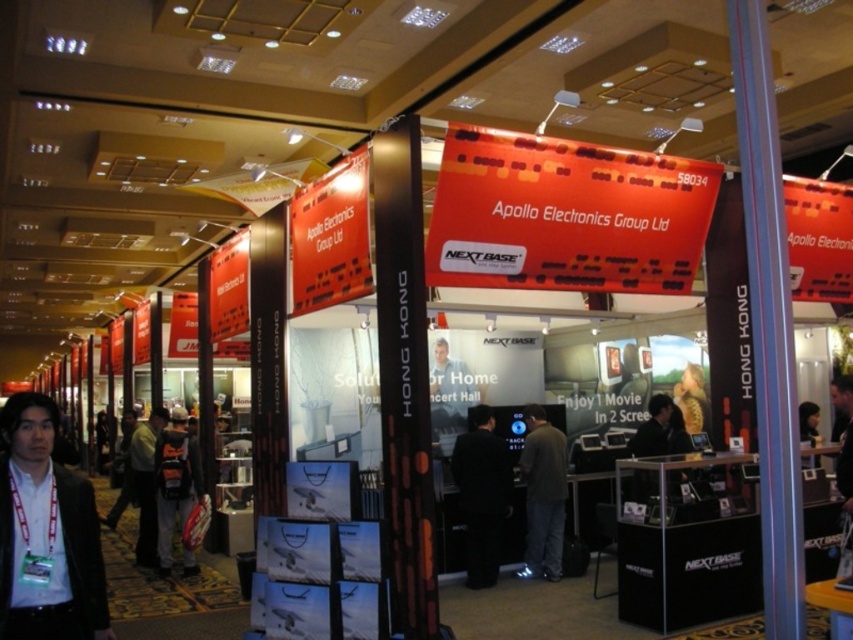
Question: Can you confirm if matte black suit at lower left is positioned below dark gray fabric jacket at center?

Choices:
 (A) yes
 (B) no

Answer: (B)

Question: Considering the real-world distances, which object is farthest from the dark gray suit at center?

Choices:
 (A) matte black suit at lower left
 (B) dark gray fabric jacket at center
 (C) orange fabric backpack at center

Answer: (A)

Question: Observing the image, what is the correct spatial positioning of orange fabric backpack at center in reference to dark gray suit at center?

Choices:
 (A) below
 (B) above

Answer: (B)

Question: Which point is farther to the camera?

Choices:
 (A) orange fabric backpack at center
 (B) matte black suit at lower left

Answer: (A)

Question: Is dark gray fabric jacket at center positioned in front of dark gray suit at center?

Choices:
 (A) no
 (B) yes

Answer: (B)

Question: Based on their relative distances, which object is farther from the dark gray fabric jacket at center?

Choices:
 (A) matte black suit at lower left
 (B) dark gray suit at center
 (C) black fabric jacket at center
 (D) orange fabric backpack at center

Answer: (A)